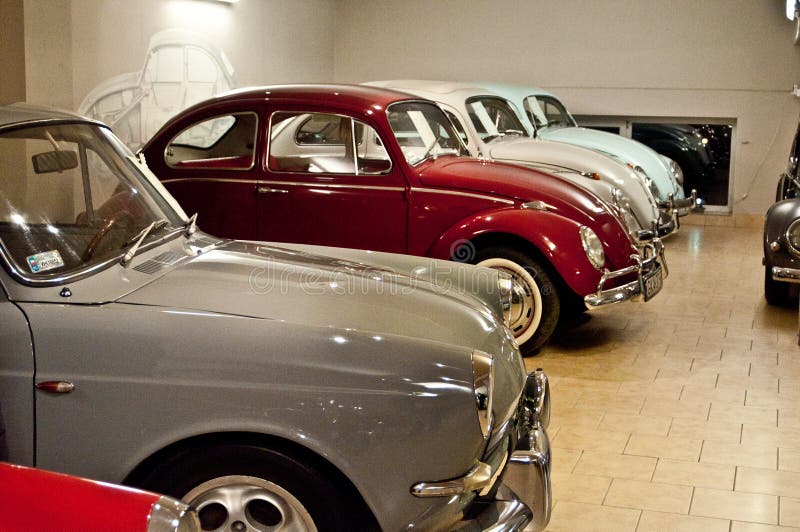
Where is `bare light creme colored interior walls`? This screenshot has width=800, height=532. bare light creme colored interior walls is located at coordinates (277, 46).